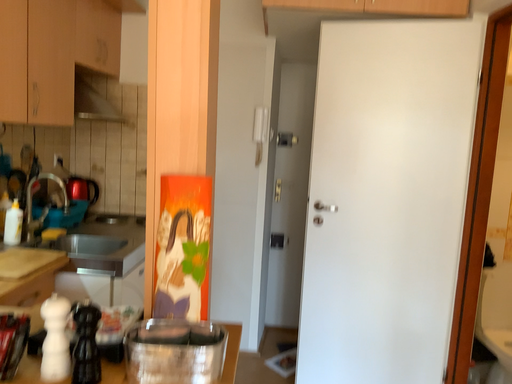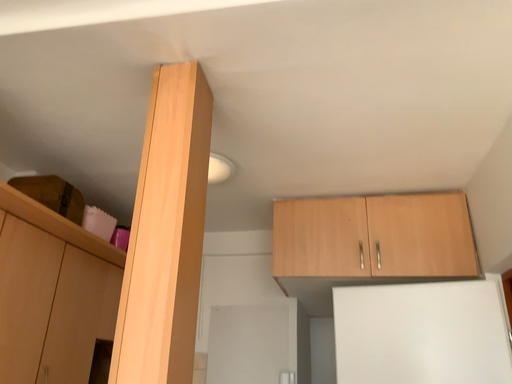
Question: How did the camera likely rotate when shooting the video?

Choices:
 (A) rotated right
 (B) rotated left

Answer: (B)